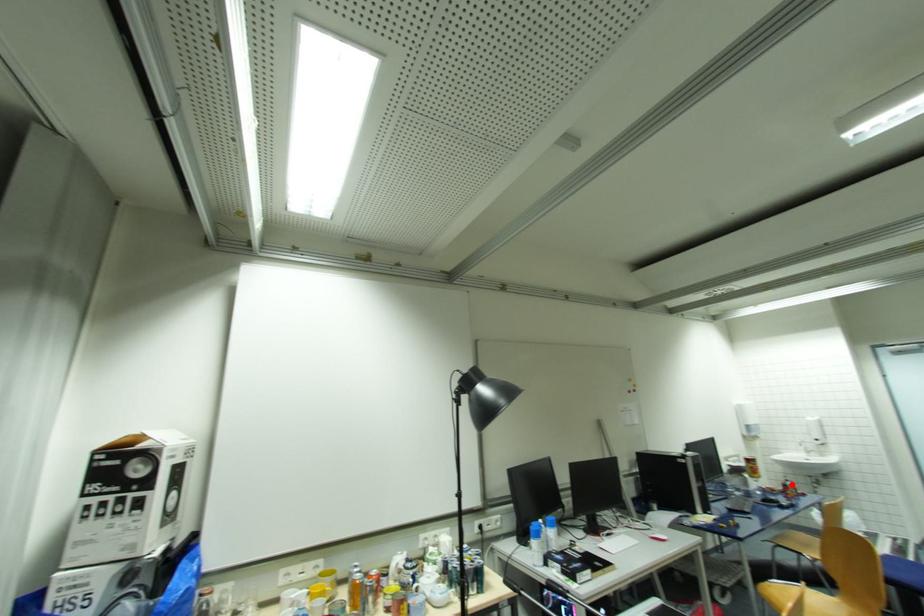
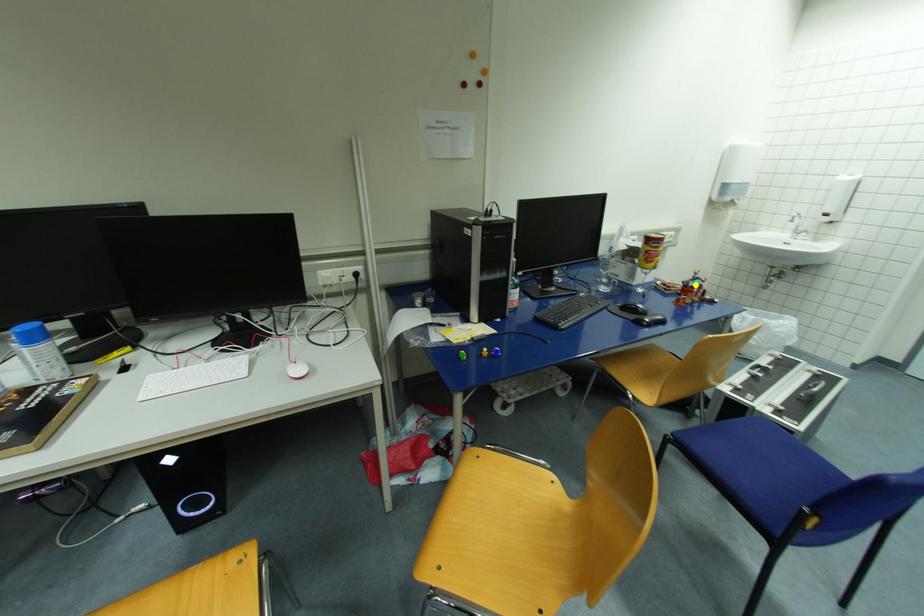
Question: I am providing you with two images of the same scene from different viewpoints. A red point is marked on the first image. You are given multiple points on the second image. Which spot in image 2 lines up with the point in image 1?

Choices:
 (A) blue point
 (B) yellow point
 (C) green point

Answer: (B)